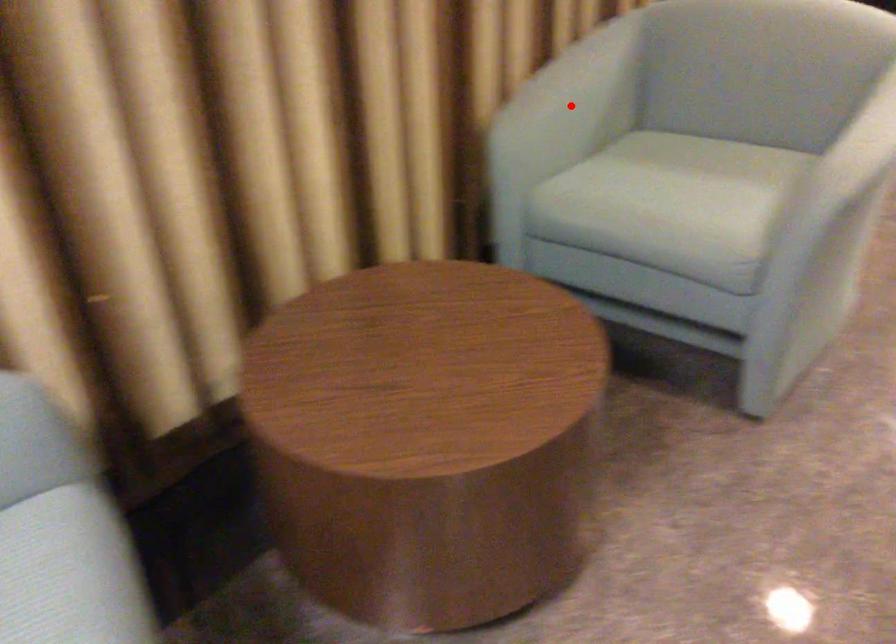
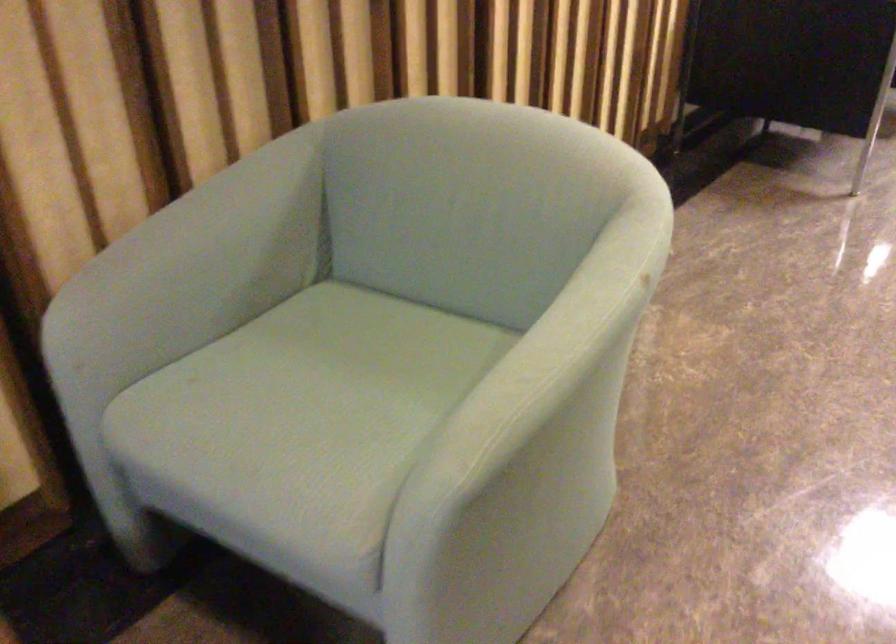
Where in the second image is the point corresponding to the highlighted location from the first image?

(192, 269)